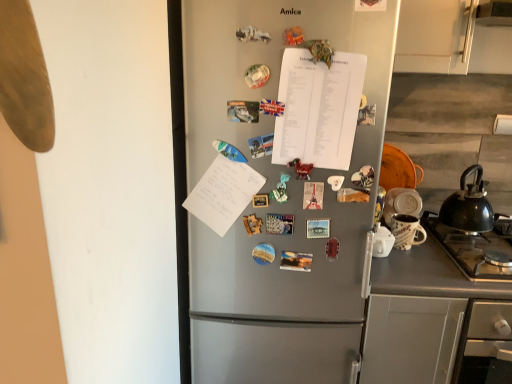
You are a GUI agent. You are given a task and a screenshot of the screen. Output one action in this format:
    pyautogui.click(x=<x>, y=<y>)
    Task: Click on the free space in front of black matte kettle at right
    This screenshot has width=512, height=384.
    Given the screenshot: What is the action you would take?
    pyautogui.click(x=480, y=248)